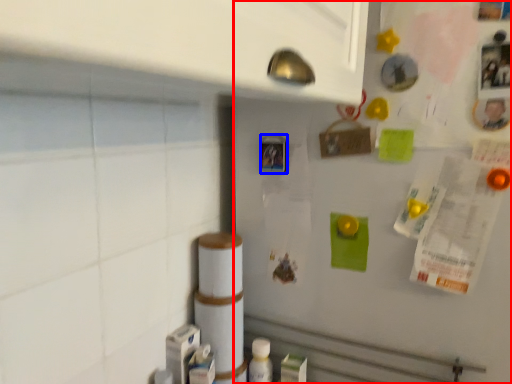
Question: Which object is further to the camera taking this photo, fridge (highlighted by a red box) or button (highlighted by a blue box)?

Choices:
 (A) fridge
 (B) button

Answer: (B)